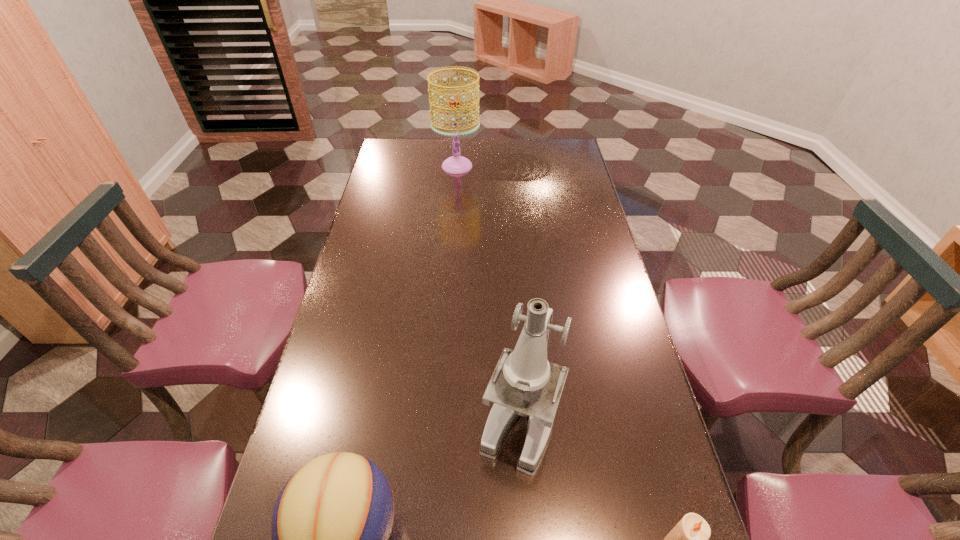
In order to click on the third nearest object in this screenshot , I will do `click(524, 383)`.

Where is `the farthest object`? This screenshot has height=540, width=960. the farthest object is located at coordinates (457, 164).

Find the location of a particular element. This screenshot has height=540, width=960. free point located on the front of the third nearest object is located at coordinates (526, 512).

The width and height of the screenshot is (960, 540). Identify the location of blank space located on the left of the lampshade. (396, 166).

Identify the location of object situated at the far edge. (457, 164).

This screenshot has width=960, height=540. In the image, there is a desktop. In order to click on free space at the far edge in this screenshot , I will do `click(440, 153)`.

Identify the location of free space at the left edge. (359, 266).

Where is `free space at the right edge of the desktop`? free space at the right edge of the desktop is located at coordinates (584, 315).

In the image, there is a desktop. Where is `vacant space at the far left corner`? Image resolution: width=960 pixels, height=540 pixels. vacant space at the far left corner is located at coordinates (397, 166).

I want to click on free space at the far right corner of the desktop, so click(x=539, y=154).